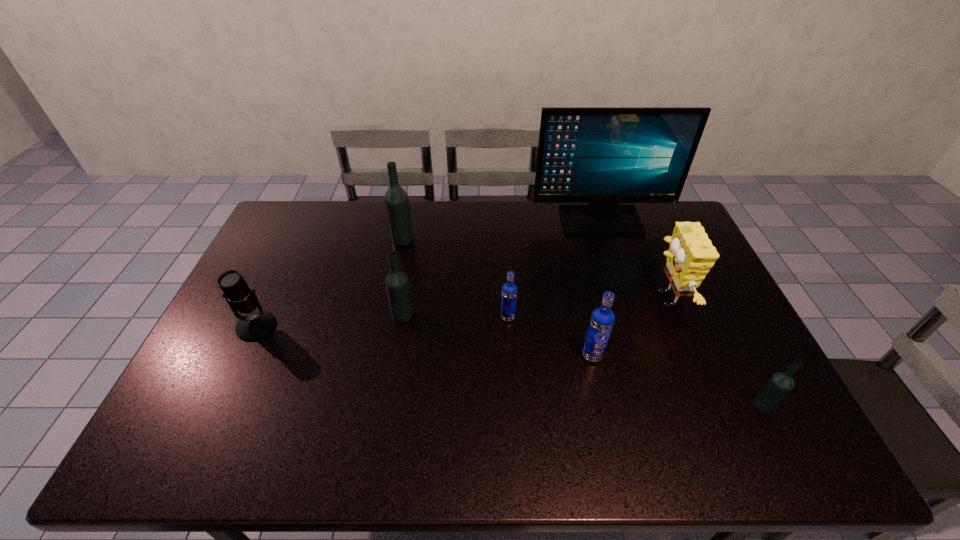
Where is `monitor`? Image resolution: width=960 pixels, height=540 pixels. monitor is located at coordinates (602, 156).

Image resolution: width=960 pixels, height=540 pixels. What are the coordinates of `the tallest object` in the screenshot? It's located at (602, 156).

Where is `the biggest black vodka`? the biggest black vodka is located at coordinates coord(396,199).

Locate an element on the screen. the second tallest object is located at coordinates (396, 199).

The height and width of the screenshot is (540, 960). In order to click on sponge in this screenshot , I will do `click(691, 255)`.

The width and height of the screenshot is (960, 540). I want to click on the seventh farthest object, so click(602, 319).

You are a GUI agent. You are given a task and a screenshot of the screen. Output one action in this format:
    pyautogui.click(x=<x>, y=<y>)
    Task: Click on the bigger blue vodka
    This screenshot has height=540, width=960.
    Given the screenshot: What is the action you would take?
    pyautogui.click(x=602, y=319)

The width and height of the screenshot is (960, 540). Identify the location of the second biggest black vodka. (397, 285).

Image resolution: width=960 pixels, height=540 pixels. Find the location of `microphone`. microphone is located at coordinates (241, 298).

Locate an element on the screen. This screenshot has width=960, height=540. the smaller blue vodka is located at coordinates (509, 290).